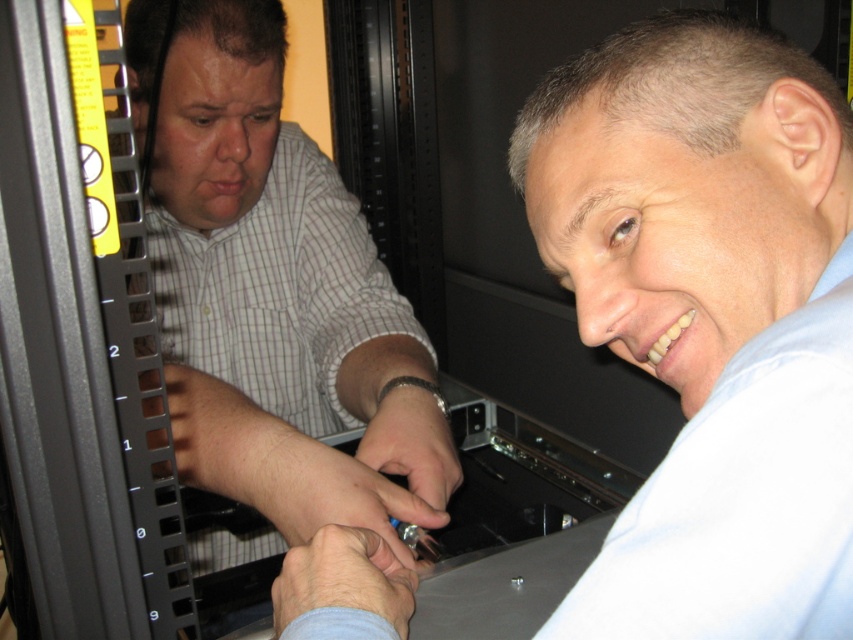
Can you confirm if light blue shirt at center is positioned to the right of white checkered shirt at left?

Yes, light blue shirt at center is to the right of white checkered shirt at left.

Who is lower down, light blue shirt at center or white checkered shirt at left?

light blue shirt at center is lower down.

Which is behind, point (672, 74) or point (196, 460)?

Point (196, 460)

Where is `light blue shirt at center`? This screenshot has width=853, height=640. light blue shirt at center is located at coordinates [x=709, y=316].